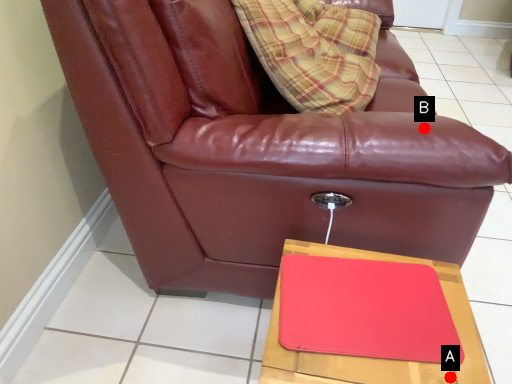
Question: Two points are circled on the image, labeled by A and B beside each circle. Which point is closer to the camera?

Choices:
 (A) A is closer
 (B) B is closer

Answer: (A)